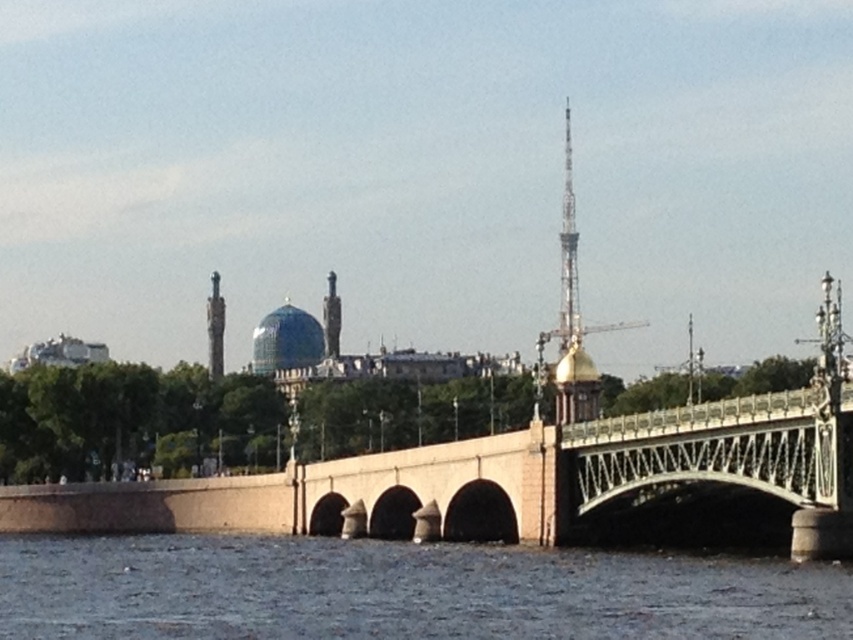
You are standing on the bridge and want to take a photo of the gray concrete river at lower center and the metallic silver tower at upper center. Which object should you pan your camera to the right to capture first?

You should pan your camera to the right to capture the metallic silver tower at upper center first because the gray concrete river at lower center is to the left of it.

You are an architect visiting the city and want to take a photo of both the stone bridge at center and the polished bronze statue at left. Since you only have one shot, you need to ensure both are fully visible. Given their sizes, which object should you frame closer to avoid cropping?

The stone bridge at center is larger in size than the polished bronze statue at left. To ensure both are fully visible without cropping, you should frame the stone bridge at center closer to the camera since it requires more space due to its larger size.